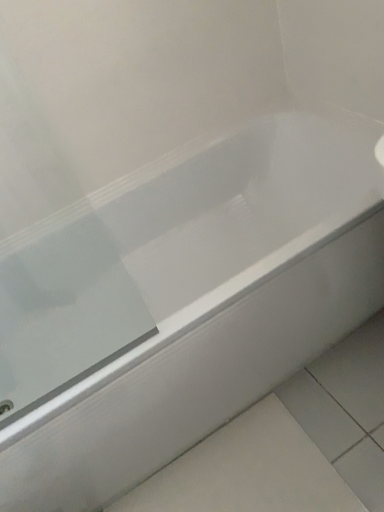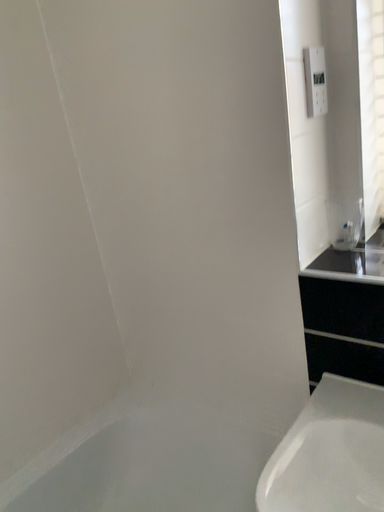
Question: How did the camera likely rotate when shooting the video?

Choices:
 (A) rotated upward
 (B) rotated downward

Answer: (A)